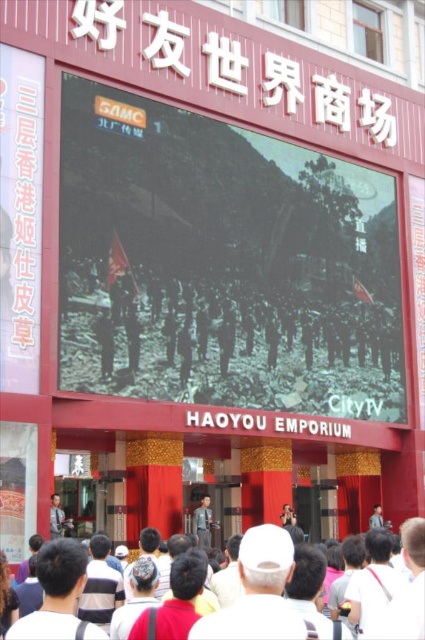
Question: Is black matte screen at center wider than khaki uniform at center?

Choices:
 (A) yes
 (B) no

Answer: (A)

Question: Can you confirm if pink paper sign at left is smaller than light brown leather jacket at lower left?

Choices:
 (A) no
 (B) yes

Answer: (A)

Question: Does black matte screen at center appear under light brown leather jacket at lower left?

Choices:
 (A) no
 (B) yes

Answer: (A)

Question: Which is nearer to the pink paper sign at left?

Choices:
 (A) black matte screen at center
 (B) light brown leather jacket at lower left

Answer: (A)

Question: Which point appears farthest from the camera in this image?

Choices:
 (A) (204, 516)
 (B) (257, 374)

Answer: (A)

Question: Among these points, which one is nearest to the camera?

Choices:
 (A) (107, 188)
 (B) (50, 513)
 (C) (210, 516)
 (D) (5, 102)

Answer: (B)